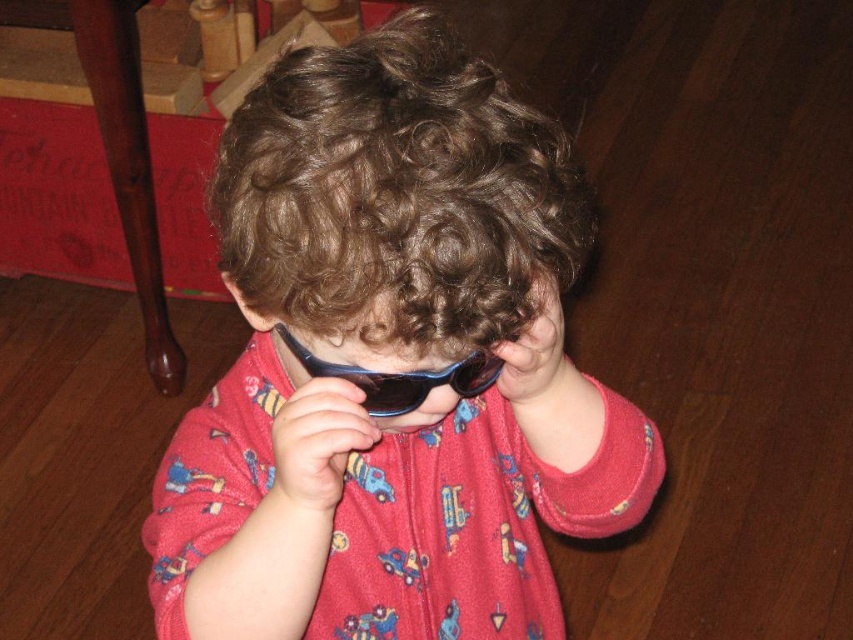
You are taking a photo of the scene and want to ensure that both the point at (630, 403) and the point at (310, 205) are in focus. Based on their positions, which point should you focus on to capture both in the sharpest possible way?

You should focus on point (310, 205) because it is closer to the viewer, and focusing on the closer object will ensure the background point (630, 403) is also in focus due to depth of field.

You are a parent trying to choose sunglasses for your child. You have two options in front of you, the matte plastic sunglasses at center and the blue plastic sunglasses at center. Based on their sizes, which one would be more suitable for a child?

The blue plastic sunglasses at center is smaller in size than the matte plastic sunglasses at center, so the blue plastic sunglasses at center would be more suitable for a child.